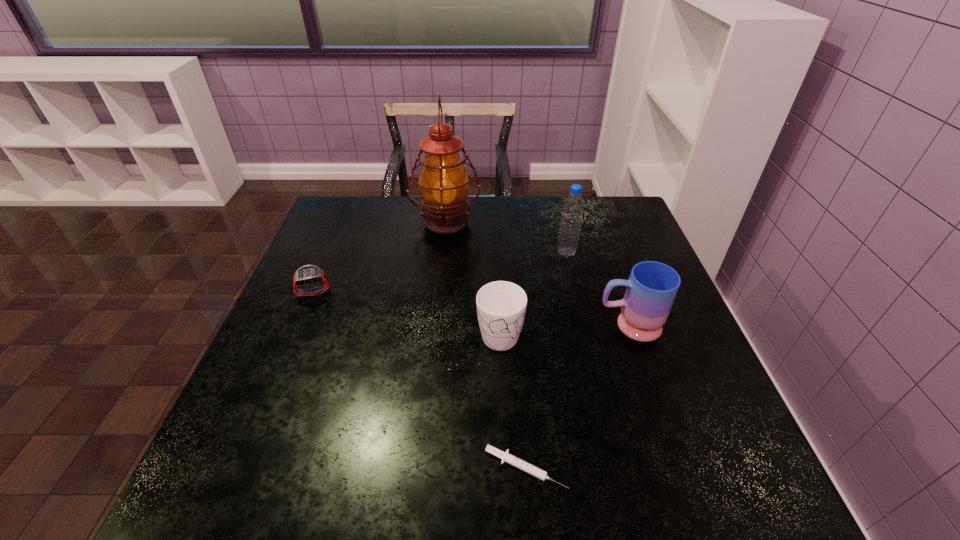
Where is `free space between the oil lamp and the shorter mug`? free space between the oil lamp and the shorter mug is located at coordinates (473, 276).

Where is `free space between the second farthest object and the right mug`? free space between the second farthest object and the right mug is located at coordinates (597, 289).

Find the location of a particular element. The height and width of the screenshot is (540, 960). vacant area that lies between the watch and the second object from right to left is located at coordinates (441, 272).

Where is `free space between the left mug and the fifth nearest object`? The width and height of the screenshot is (960, 540). free space between the left mug and the fifth nearest object is located at coordinates (533, 292).

Where is `free space between the left mug and the third tallest object`? Image resolution: width=960 pixels, height=540 pixels. free space between the left mug and the third tallest object is located at coordinates (564, 329).

The image size is (960, 540). Find the location of `vacant space that's between the watch and the farthest object`. vacant space that's between the watch and the farthest object is located at coordinates (380, 256).

Find the location of a particular element. free space between the second tallest object and the third shortest object is located at coordinates (533, 292).

The height and width of the screenshot is (540, 960). What are the coordinates of `vacant space that is in between the leftmost object and the fifth object from left to right` in the screenshot? It's located at (441, 272).

You are a GUI agent. You are given a task and a screenshot of the screen. Output one action in this format:
    pyautogui.click(x=<x>, y=<y>)
    Task: Click on the vacant area that lies between the fourth nearest object and the shortest object
    This screenshot has height=540, width=960.
    Given the screenshot: What is the action you would take?
    click(x=420, y=380)

You are a GUI agent. You are given a task and a screenshot of the screen. Output one action in this format:
    pyautogui.click(x=<x>, y=<y>)
    Task: Click on the free area in between the oil lamp and the fifth shortest object
    This screenshot has height=540, width=960.
    Given the screenshot: What is the action you would take?
    pyautogui.click(x=506, y=237)